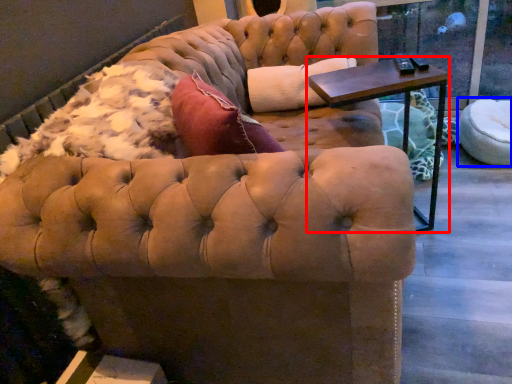
Question: Which of the following is the closest to the observer, table (highlighted by a red box) or swivel chair (highlighted by a blue box)?

Choices:
 (A) table
 (B) swivel chair

Answer: (A)